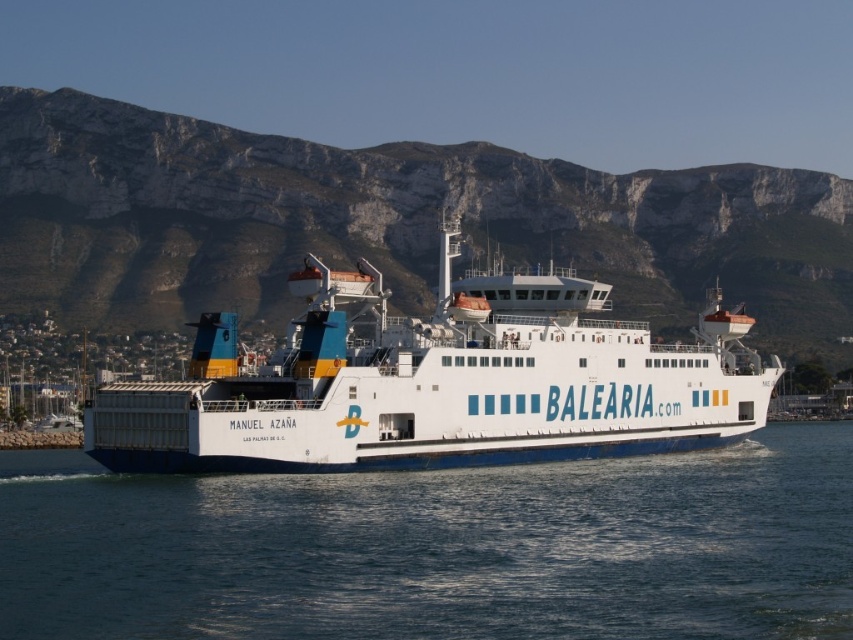
Question: Which point is closer to the camera?

Choices:
 (A) white matte ferry at center
 (B) white rocky mountain at upper center

Answer: (A)

Question: Can you confirm if blue water at center is smaller than white matte ferry at center?

Choices:
 (A) yes
 (B) no

Answer: (A)

Question: Which of the following is the farthest from the observer?

Choices:
 (A) (61, 451)
 (B) (569, 253)

Answer: (B)

Question: From the image, what is the correct spatial relationship of blue water at center in relation to white rocky mountain at upper center?

Choices:
 (A) below
 (B) above

Answer: (A)

Question: Is white rocky mountain at upper center to the left of white matte ferry at center from the viewer's perspective?

Choices:
 (A) yes
 (B) no

Answer: (B)

Question: Which of the following is the closest to the observer?

Choices:
 (A) (303, 368)
 (B) (103, 204)

Answer: (A)